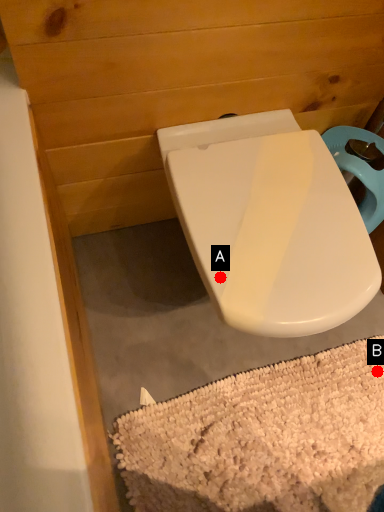
Question: Two points are circled on the image, labeled by A and B beside each circle. Which point is closer to the camera?

Choices:
 (A) A is closer
 (B) B is closer

Answer: (A)